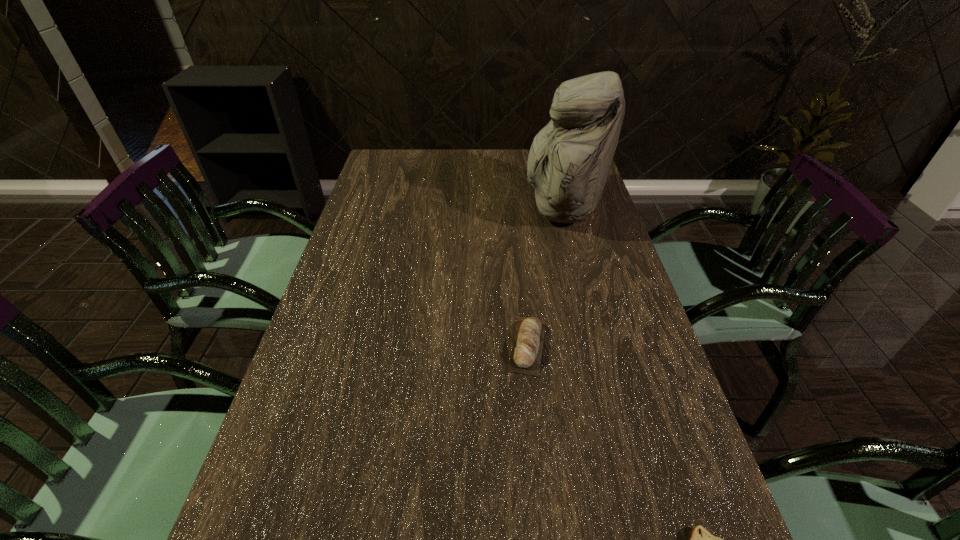
What are the coordinates of `free space that satisfies the following two spatial constraints: 1. on the front-facing side of the backpack; 2. on the front side of the farther pita bread` in the screenshot? It's located at (595, 346).